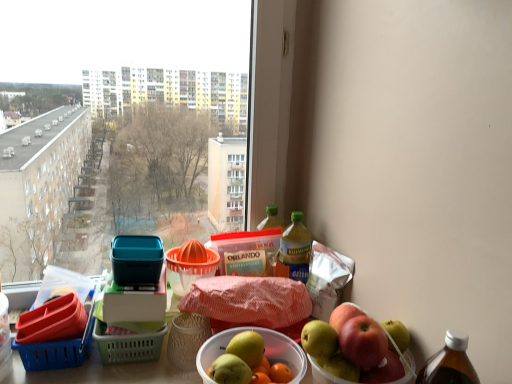
Question: From a real-world perspective, is translucent plastic bottle at upper right, marked as the first bottle in a left-to-right arrangement, positioned under yellow translucent bottle at upper right, the 2th bottle from the left, based on gravity?

Choices:
 (A) yes
 (B) no

Answer: (B)

Question: Does translucent plastic bottle at upper right, which ranks as the second bottle in right-to-left order, have a greater height compared to yellow translucent bottle at upper right, the 2th bottle from the left?

Choices:
 (A) no
 (B) yes

Answer: (B)

Question: From the image's perspective, is translucent plastic bottle at upper right, marked as the first bottle in a left-to-right arrangement, under yellow translucent bottle at upper right, the 2th bottle from the left?

Choices:
 (A) no
 (B) yes

Answer: (A)

Question: From the image's perspective, does translucent plastic bottle at upper right, marked as the first bottle in a left-to-right arrangement, appear higher than yellow translucent bottle at upper right, the 2th bottle from the left?

Choices:
 (A) yes
 (B) no

Answer: (A)

Question: Considering the relative positions of translucent plastic bottle at upper right, which ranks as the second bottle in right-to-left order, and yellow translucent bottle at upper right, the 2th bottle from the left, in the image provided, is translucent plastic bottle at upper right, which ranks as the second bottle in right-to-left order, to the left of yellow translucent bottle at upper right, the 2th bottle from the left, from the viewer's perspective?

Choices:
 (A) yes
 (B) no

Answer: (A)

Question: Does point (181, 263) appear closer or farther from the camera than point (298, 220)?

Choices:
 (A) closer
 (B) farther

Answer: (A)

Question: Considering the positions of orange plastic juicer at center, which is counted as the 2th basket, starting from the left, and yellow translucent bottle at upper right, the 2th bottle from the left, in the image, is orange plastic juicer at center, which is counted as the 2th basket, starting from the left, wider or thinner than yellow translucent bottle at upper right, the 2th bottle from the left,?

Choices:
 (A) thin
 (B) wide

Answer: (B)

Question: Is orange plastic juicer at center, which is counted as the 2th basket, starting from the left, spatially inside yellow translucent bottle at upper right, the 2th bottle from the left, or outside of it?

Choices:
 (A) outside
 (B) inside

Answer: (A)

Question: In terms of height, does orange plastic juicer at center, which is the second basket from bottom to top, look taller or shorter compared to yellow translucent bottle at upper right, the 2th bottle from the left?

Choices:
 (A) short
 (B) tall

Answer: (A)

Question: Considering the positions of translucent plastic bottle at upper right, which ranks as the second bottle in right-to-left order, and yellow translucent bottle at upper right, the 2th bottle from the left, in the image, is translucent plastic bottle at upper right, which ranks as the second bottle in right-to-left order, wider or thinner than yellow translucent bottle at upper right, the 2th bottle from the left,?

Choices:
 (A) wide
 (B) thin

Answer: (B)

Question: In terms of size, does translucent plastic bottle at upper right, which ranks as the second bottle in right-to-left order, appear bigger or smaller than yellow translucent bottle at upper right, the 2th bottle from the left?

Choices:
 (A) big
 (B) small

Answer: (B)

Question: Choose the correct answer: Is translucent plastic bottle at upper right, marked as the first bottle in a left-to-right arrangement, inside yellow translucent bottle at upper right, arranged as the first bottle when viewed from the right, or outside it?

Choices:
 (A) inside
 (B) outside

Answer: (B)

Question: From a real-world perspective, is translucent plastic bottle at upper right, which ranks as the second bottle in right-to-left order, positioned above or below yellow translucent bottle at upper right, arranged as the first bottle when viewed from the right?

Choices:
 (A) above
 (B) below

Answer: (A)

Question: From the image's perspective, is shiny red apple at right located above or below blue plastic basket at lower left, the 1th basket when ordered from left to right?

Choices:
 (A) below
 (B) above

Answer: (A)

Question: Is shiny red apple at right in front of or behind blue plastic basket at lower left, which is the first basket from bottom to top, in the image?

Choices:
 (A) front
 (B) behind

Answer: (A)